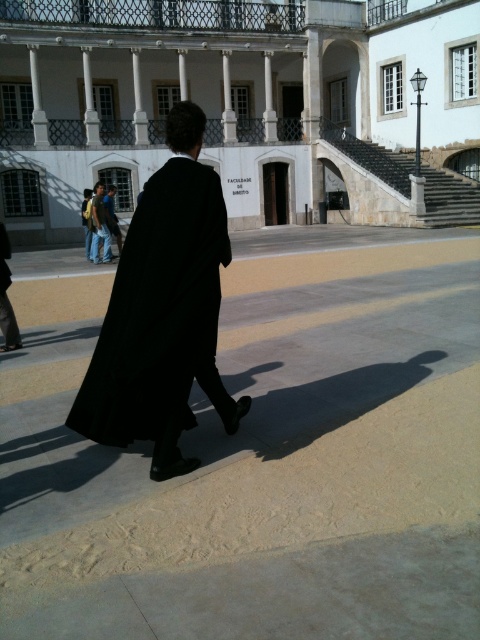
Is white stone building at center to the right of black matte coat at center from the viewer's perspective?

Incorrect, white stone building at center is not on the right side of black matte coat at center.

From the picture: Can you confirm if white stone building at center is smaller than black matte coat at center?

No, white stone building at center is not smaller than black matte coat at center.

Image resolution: width=480 pixels, height=640 pixels. What do you see at coordinates (242, 106) in the screenshot? I see `white stone building at center` at bounding box center [242, 106].

The height and width of the screenshot is (640, 480). I want to click on white stone building at center, so click(x=242, y=106).

Is white stone building at center below denim jeans at lower left?

Actually, white stone building at center is above denim jeans at lower left.

Is point (478, 83) positioned before point (97, 211)?

No.

Identify the location of white stone building at center. (242, 106).

Between point (223, 216) and point (95, 209), which one is positioned behind?

The point (95, 209) is more distant.

Who is higher up, black matte coat at center or denim jeans at lower left?

denim jeans at lower left is higher up.

You are a GUI agent. You are given a task and a screenshot of the screen. Output one action in this format:
    pyautogui.click(x=<x>, y=<y>)
    Task: Click on the black matte coat at center
    Image resolution: width=480 pixels, height=640 pixels.
    Given the screenshot: What is the action you would take?
    pyautogui.click(x=159, y=312)